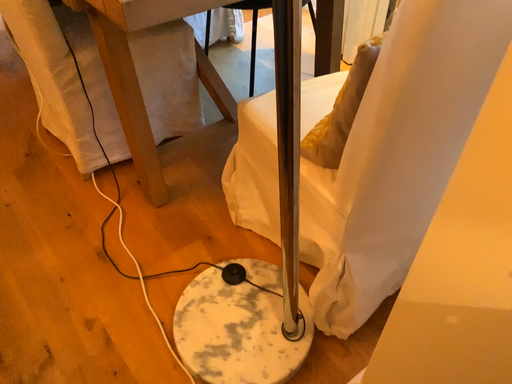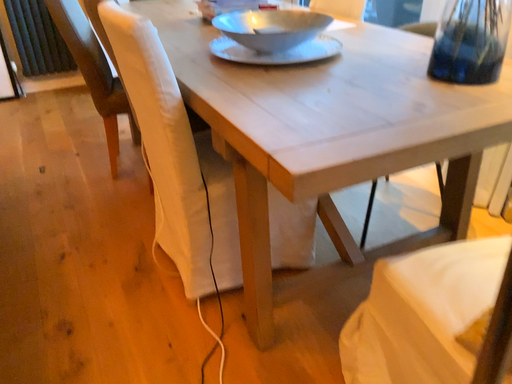
Question: How did the camera likely rotate when shooting the video?

Choices:
 (A) rotated left
 (B) rotated right

Answer: (A)